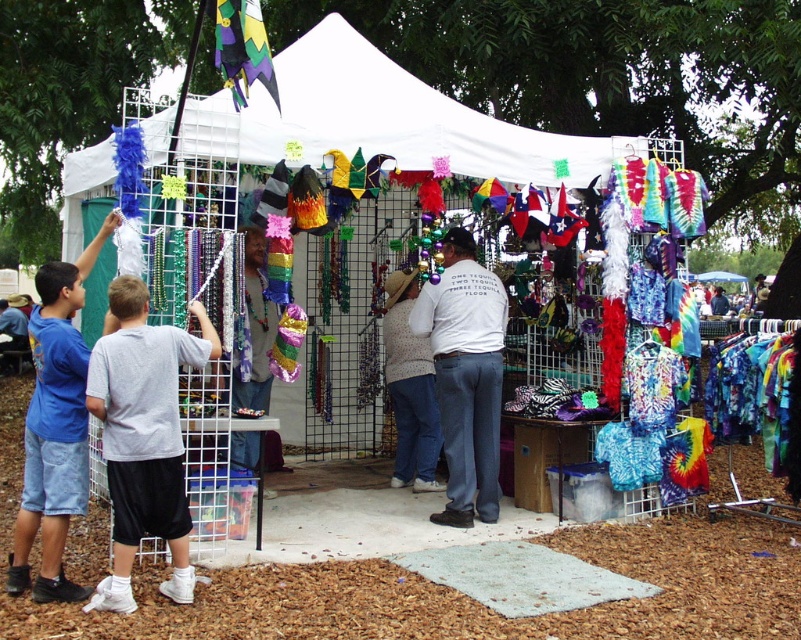
Can you confirm if blue denim shorts at lower left is wider than shiny metallic beads at center?

Yes, blue denim shorts at lower left is wider than shiny metallic beads at center.

Does blue denim shorts at lower left have a smaller size compared to shiny metallic beads at center?

Actually, blue denim shorts at lower left might be larger than shiny metallic beads at center.

Find the location of a particular element. The image size is (801, 640). blue denim shorts at lower left is located at coordinates (55, 428).

Image resolution: width=801 pixels, height=640 pixels. Find the location of `blue denim shorts at lower left`. blue denim shorts at lower left is located at coordinates (55, 428).

Is gray cotton shirt at left taller than blue denim shorts at lower left?

Incorrect, gray cotton shirt at left's height is not larger of blue denim shorts at lower left's.

Is gray cotton shirt at left shorter than blue denim shorts at lower left?

Yes.

Is point (160, 330) more distant than point (41, 358)?

No, it is in front of (41, 358).

You are a GUI agent. You are given a task and a screenshot of the screen. Output one action in this format:
    pyautogui.click(x=<x>, y=<y>)
    Task: Click on the gray cotton shirt at left
    This screenshot has height=640, width=801.
    Given the screenshot: What is the action you would take?
    (143, 436)

Can you confirm if white cotton shirt at center is thinner than shiny metallic beads at center?

No.

Can you confirm if white cotton shirt at center is positioned above shiny metallic beads at center?

No.

Where is `white cotton shirt at center`? Image resolution: width=801 pixels, height=640 pixels. white cotton shirt at center is located at coordinates (465, 376).

The height and width of the screenshot is (640, 801). In order to click on white cotton shirt at center in this screenshot , I will do `click(465, 376)`.